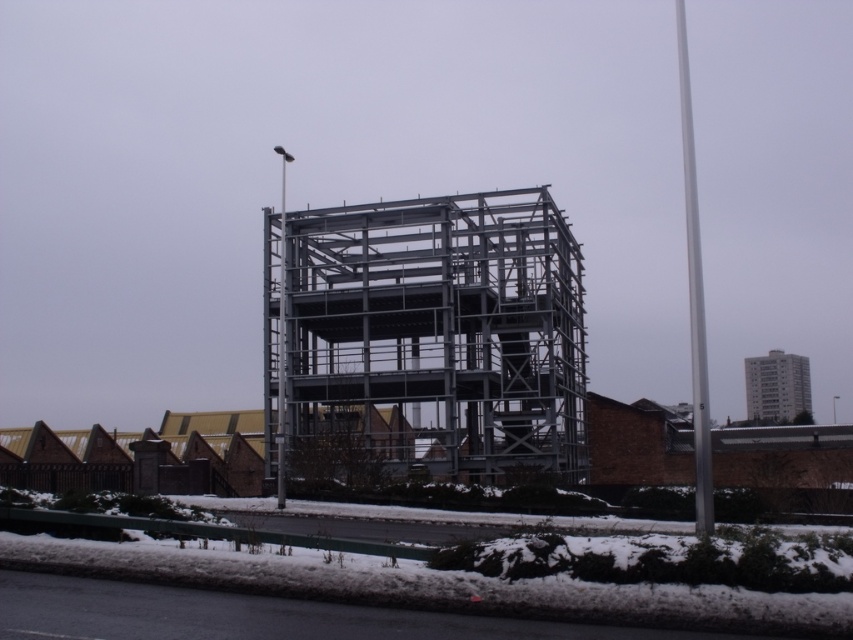
You are a construction worker standing on the road near the green railing. You need to determine which object is taller between the metallic structure at center and the metallic gray pole at center. Based on the scene, which one is taller?

The metallic gray pole at center is taller than the metallic structure at center.